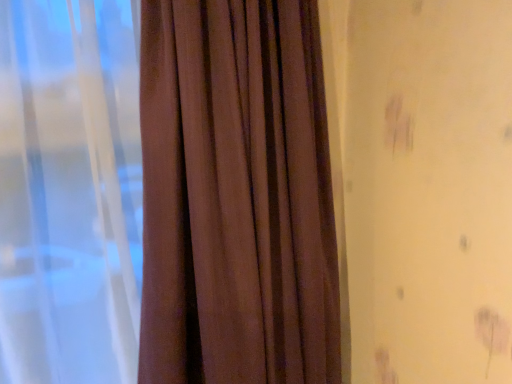
At what (x,y) coordinates should I click in order to perform the action: click on brown velvet curtain at center. Please return your answer as a coordinate pair (x, y). Looking at the image, I should click on (165, 194).

Describe the element at coordinates (165, 194) in the screenshot. I see `brown velvet curtain at center` at that location.

Find the location of a particular element. Image resolution: width=512 pixels, height=384 pixels. brown velvet curtain at center is located at coordinates (165, 194).